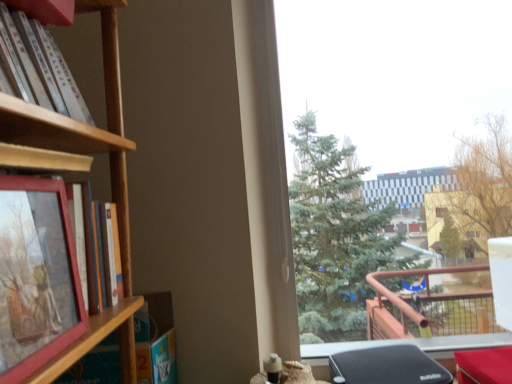
Question: From the image's perspective, does transparent glass window at upper right appear higher than matte wooden picture frame at left?

Choices:
 (A) yes
 (B) no

Answer: (A)

Question: From the image's perspective, is transparent glass window at upper right under matte wooden picture frame at left?

Choices:
 (A) yes
 (B) no

Answer: (B)

Question: Is transparent glass window at upper right wider than matte wooden picture frame at left?

Choices:
 (A) no
 (B) yes

Answer: (B)

Question: Is transparent glass window at upper right bigger than matte wooden picture frame at left?

Choices:
 (A) no
 (B) yes

Answer: (B)

Question: Would you consider transparent glass window at upper right to be distant from matte wooden picture frame at left?

Choices:
 (A) no
 (B) yes

Answer: (B)

Question: From a real-world perspective, is transparent glass window at upper right above or below matte wooden book at left, which is the second book from top to bottom?

Choices:
 (A) below
 (B) above

Answer: (B)

Question: Is transparent glass window at upper right inside or outside of matte wooden book at left, which is the second book from top to bottom?

Choices:
 (A) inside
 (B) outside

Answer: (B)

Question: Based on their positions, is transparent glass window at upper right located to the left or right of matte wooden book at left, marked as the first book in a bottom-to-top arrangement?

Choices:
 (A) right
 (B) left

Answer: (A)

Question: In terms of width, does transparent glass window at upper right look wider or thinner when compared to matte wooden book at left, marked as the first book in a bottom-to-top arrangement?

Choices:
 (A) thin
 (B) wide

Answer: (B)

Question: In terms of width, does matte wooden book at left, marked as the first book in a bottom-to-top arrangement, look wider or thinner when compared to transparent glass window at upper right?

Choices:
 (A) wide
 (B) thin

Answer: (B)

Question: From a real-world perspective, relative to transparent glass window at upper right, is matte wooden book at left, which is the second book from top to bottom, vertically above or below?

Choices:
 (A) above
 (B) below

Answer: (B)

Question: Is point (104, 279) closer or farther from the camera than point (289, 114)?

Choices:
 (A) farther
 (B) closer

Answer: (B)

Question: In the image, is matte wooden book at left, marked as the first book in a bottom-to-top arrangement, positioned in front of or behind transparent glass window at upper right?

Choices:
 (A) behind
 (B) front

Answer: (B)

Question: Is white matte book at upper left, arranged as the 1th book when viewed from the top, spatially inside wooden shelf at left, or outside of it?

Choices:
 (A) outside
 (B) inside

Answer: (A)

Question: From a real-world perspective, is white matte book at upper left, arranged as the 1th book when viewed from the top, positioned above or below wooden shelf at left?

Choices:
 (A) above
 (B) below

Answer: (A)